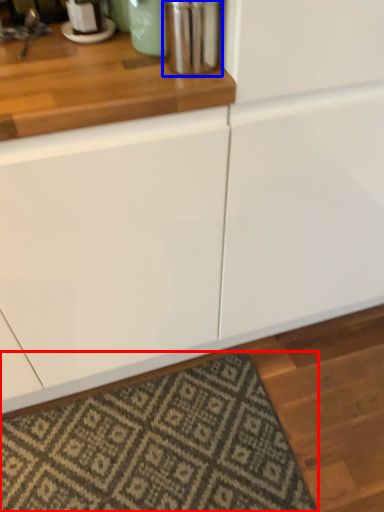
Question: Which point is further to the camera, mat (highlighted by a red box) or appliance (highlighted by a blue box)?

Choices:
 (A) mat
 (B) appliance

Answer: (A)